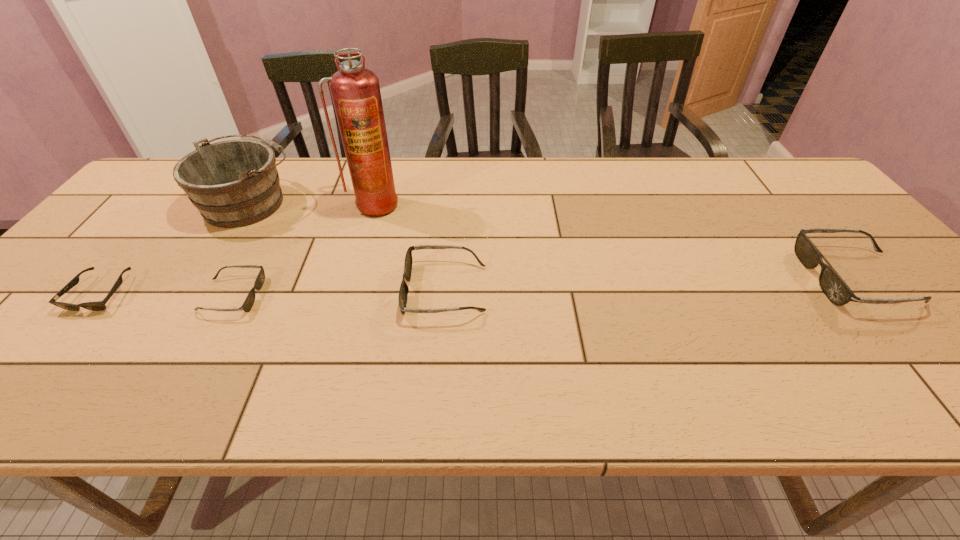
Locate an element on the screen. The width and height of the screenshot is (960, 540). object positioned at the left edge is located at coordinates (97, 305).

Identify the location of object at the right edge. (833, 286).

This screenshot has height=540, width=960. I want to click on vacant area at the far edge, so click(481, 168).

Where is `vacant region at the near edge`? The width and height of the screenshot is (960, 540). vacant region at the near edge is located at coordinates (401, 344).

At what (x,y) coordinates should I click in order to perform the action: click on vacant space at the left edge. Please return your answer as a coordinate pair (x, y). This screenshot has height=540, width=960. Looking at the image, I should click on (141, 241).

At what (x,y) coordinates should I click in order to perform the action: click on vacant space at the right edge. Please return your answer as a coordinate pair (x, y). The image size is (960, 540). Looking at the image, I should click on (905, 290).

Where is `vacant area between the second tallest sunglasses and the rightmost object`? The image size is (960, 540). vacant area between the second tallest sunglasses and the rightmost object is located at coordinates (651, 284).

Find the location of a particular element. Image resolution: width=960 pixels, height=540 pixels. empty location between the leftmost sunglasses and the rightmost object is located at coordinates (478, 286).

I want to click on free space between the third sunglasses from right to left and the fourth tallest object, so click(x=339, y=293).

Find the location of a particular element. vacant space that's between the wine bucket and the third object from right to left is located at coordinates (312, 203).